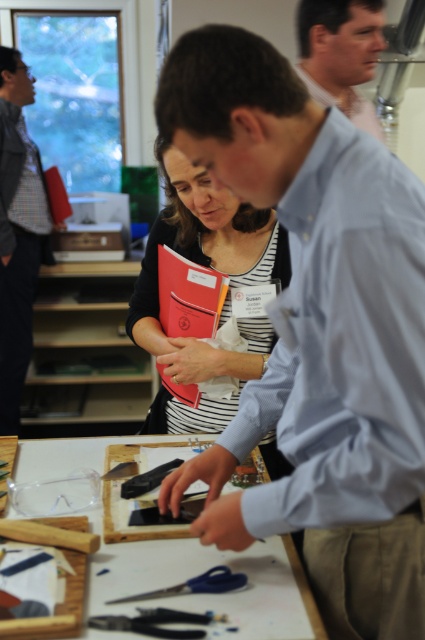
Question: From the image, what is the correct spatial relationship of blue shirt at center in relation to black plastic tool at center?

Choices:
 (A) below
 (B) above

Answer: (B)

Question: Which of the following is the farthest from the observer?

Choices:
 (A) orange matte folder at center
 (B) blue shirt at center
 (C) blue plastic scissors at lower center
 (D) matte black shirt at left

Answer: (D)

Question: Does matte black shirt at left appear on the right side of blue plastic scissors at lower center?

Choices:
 (A) yes
 (B) no

Answer: (B)

Question: Which is farther from the white paperboard at center?

Choices:
 (A) blue plastic scissors at lower center
 (B) matte blue shirt at upper center
 (C) blue shirt at center

Answer: (B)

Question: Which point is closer to the camera taking this photo?

Choices:
 (A) (19, 81)
 (B) (204, 212)
 (C) (251, 630)
 (D) (221, 582)

Answer: (C)

Question: From the image, what is the correct spatial relationship of matte blue shirt at upper center in relation to black plastic tool at center?

Choices:
 (A) above
 (B) below

Answer: (A)